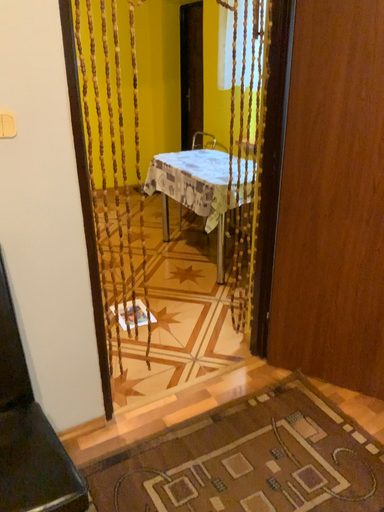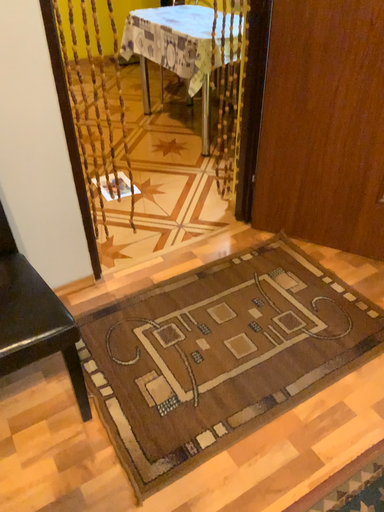
Question: Which way did the camera rotate in the video?

Choices:
 (A) rotated downward
 (B) rotated upward

Answer: (A)